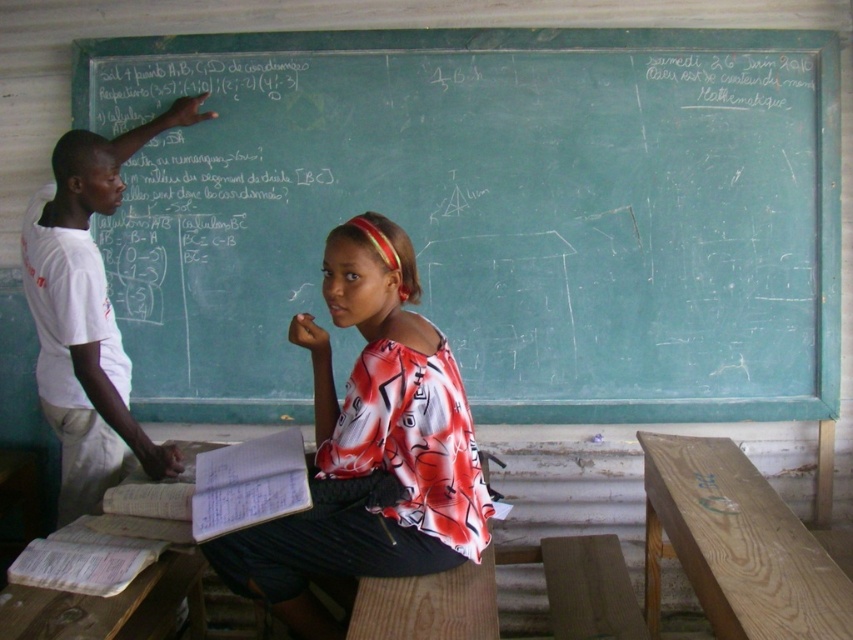
Question: Which object is closer to the camera taking this photo?

Choices:
 (A) white t-shirt at left
 (B) light brown wooden table at right
 (C) printed fabric shirt at center

Answer: (B)

Question: Among these points, which one is farthest from the camera?

Choices:
 (A) (33, 314)
 (B) (790, 560)
 (C) (612, 81)

Answer: (C)

Question: Can you confirm if printed fabric shirt at center is bigger than light brown wooden table at right?

Choices:
 (A) yes
 (B) no

Answer: (A)

Question: Which of these objects is positioned closest to the white t-shirt at left?

Choices:
 (A) green chalkboard at upper center
 (B) light brown wooden table at right

Answer: (A)

Question: Where is green chalkboard at upper center located in relation to printed fabric shirt at center in the image?

Choices:
 (A) left
 (B) right

Answer: (B)

Question: Is printed fabric shirt at center below light brown wooden table at right?

Choices:
 (A) yes
 (B) no

Answer: (B)